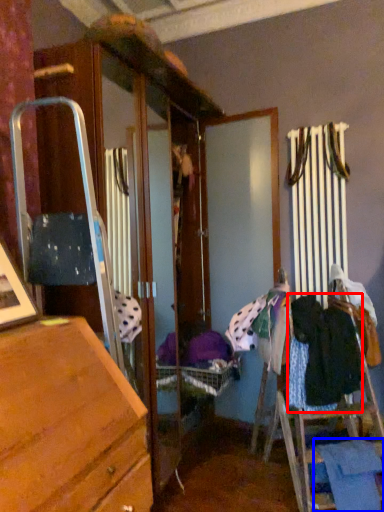
Question: Which object appears farthest to the camera in this image, clothing (highlighted by a red box) or clothing (highlighted by a blue box)?

Choices:
 (A) clothing
 (B) clothing

Answer: (A)